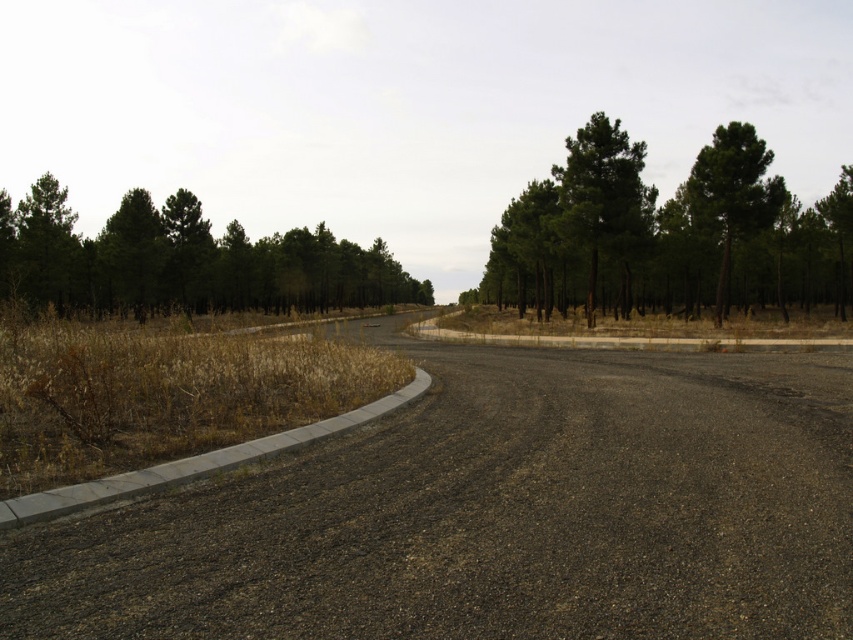
You are driving a car that is 15 feet long. You need to park your car between the green matte trees at upper left and the green leafy tree at upper right. Is there enough space between them to park your car?

The distance between the green matte trees at upper left and the green leafy tree at upper right is 201.45 feet, which is more than enough space to park a 15 feet long car between them.

You are standing at the point labeled as point (161, 220) in the rural road scene. A cyclist is approaching you from the direction of the road that curves to the right. The cyclist is currently 60 meters away from you. If the cyclist maintains a constant speed of 15 km per hour, how many seconds will it take for the cyclist to reach your position?

The point labeled point (161, 220) is 60.36 meters away from the viewer. The cyclist is approaching from the road curving to the right and is currently 60 meters away. To calculate the time, convert 15 km per hour to meters per second by dividing by 3.6, resulting in approximately 4.17 m per second. Divide the distance by speed to get the time in seconds. 60 meters divided by 4.17 m per second equals approximately 14.4 seconds. Therefore, the cyclist will reach the point in about 14.4 seconds.